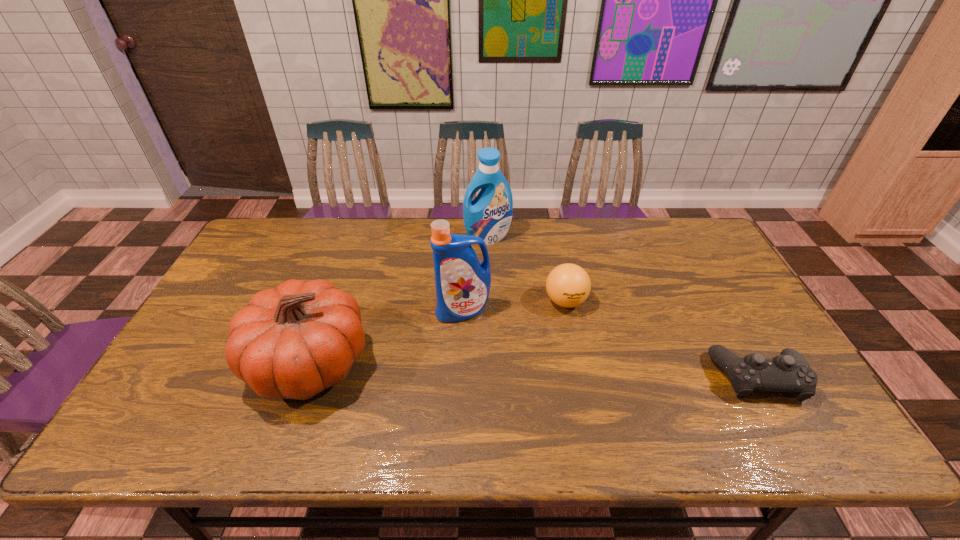
The image size is (960, 540). In order to click on the leftmost object in this screenshot , I will do `click(293, 341)`.

Where is `the third shortest object`? The height and width of the screenshot is (540, 960). the third shortest object is located at coordinates (293, 341).

Locate an element on the screen. Image resolution: width=960 pixels, height=540 pixels. the rightmost object is located at coordinates (789, 372).

Find the location of a particular element. Image resolution: width=960 pixels, height=540 pixels. the shortest object is located at coordinates (789, 372).

Where is `the farthest object`? The width and height of the screenshot is (960, 540). the farthest object is located at coordinates (488, 216).

This screenshot has height=540, width=960. Find the location of `the fourth object from left to right`. the fourth object from left to right is located at coordinates (568, 285).

You are a GUI agent. You are given a task and a screenshot of the screen. Output one action in this format:
    pyautogui.click(x=<x>, y=<y>)
    Task: Click on the fourth tallest object
    This screenshot has width=960, height=540.
    Given the screenshot: What is the action you would take?
    pyautogui.click(x=568, y=285)

Find the location of `the nearer detergent`. the nearer detergent is located at coordinates (462, 283).

Find the location of a particular element. The image size is (960, 540). vacant region located 0.170m on the face of the third shortest object is located at coordinates (182, 363).

Where is `vacant space positioned 0.130m on the face of the third shortest object`? vacant space positioned 0.130m on the face of the third shortest object is located at coordinates (198, 363).